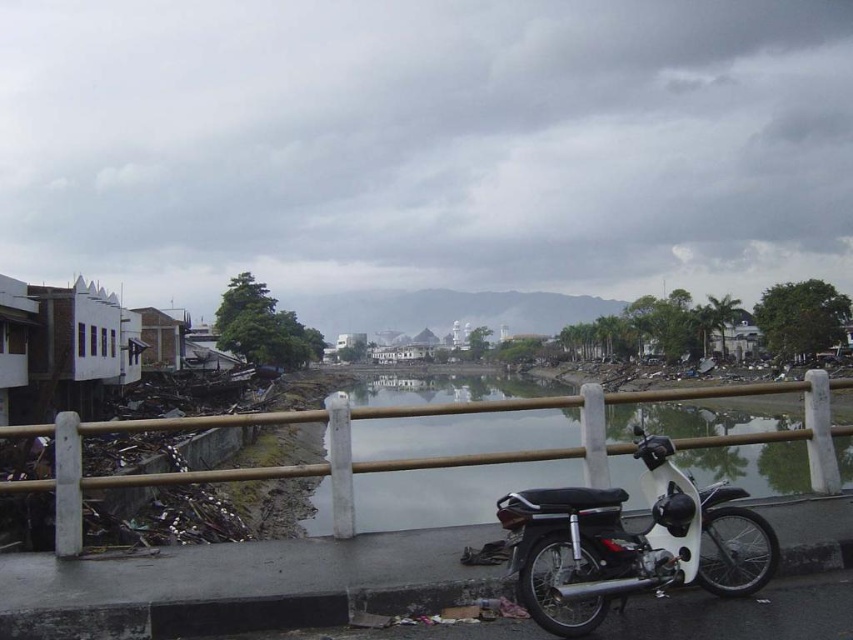
Can you confirm if white concrete fence at center is positioned above white matte motorcycle at lower right?

Actually, white concrete fence at center is below white matte motorcycle at lower right.

Does white concrete fence at center have a greater width compared to white matte motorcycle at lower right?

Indeed, white concrete fence at center has a greater width compared to white matte motorcycle at lower right.

Identify the location of white concrete fence at center. The image size is (853, 640). 424,458.